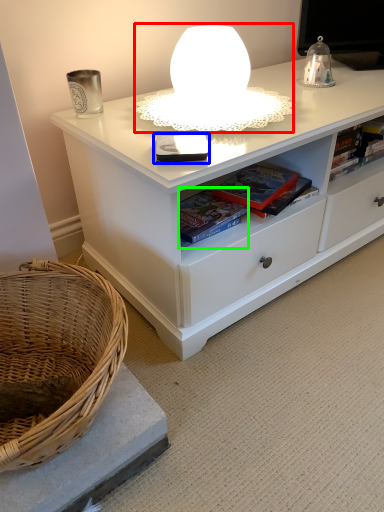
Question: Which object is the farthest from table lamp (highlighted by a red box)? Choose among these: book (highlighted by a blue box) or book (highlighted by a green box).

Choices:
 (A) book
 (B) book

Answer: (B)